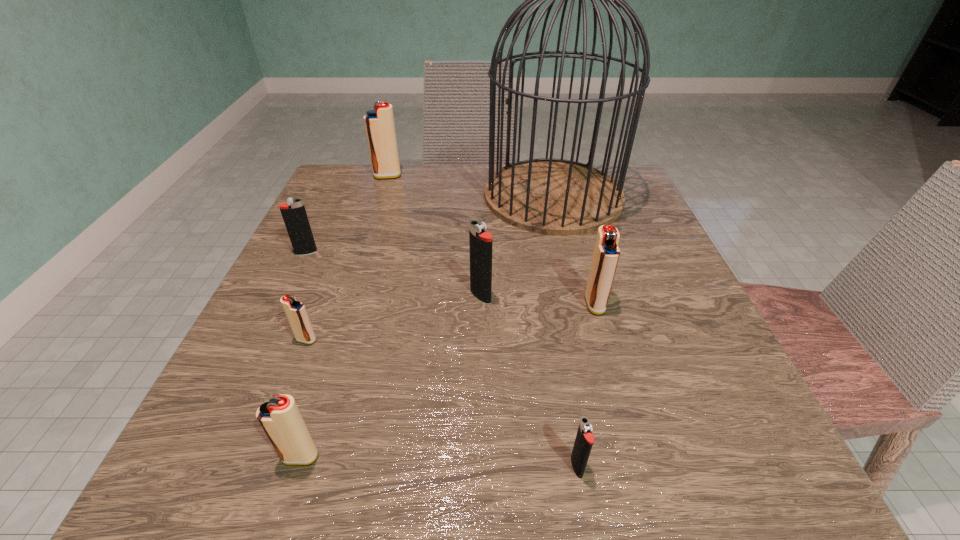
Identify the location of the nearest red igniter. (280, 418).

Locate an element on the screen. Image resolution: width=960 pixels, height=540 pixels. the third farthest red igniter is located at coordinates (295, 311).

Locate an element on the screen. This screenshot has width=960, height=540. the fifth farthest igniter is located at coordinates (295, 311).

The image size is (960, 540). I want to click on the sixth igniter from left to right, so click(584, 440).

This screenshot has width=960, height=540. In order to click on the nearest black igniter in this screenshot , I will do `click(584, 440)`.

At what (x,y) coordinates should I click in order to perform the action: click on free space located at the door of the tallest object. Please return your answer as a coordinate pair (x, y). Looking at the image, I should click on (341, 196).

Identify the location of free spot located at the door of the tallest object. This screenshot has width=960, height=540. (371, 196).

Where is `vacant region located at the door of the tallest object`? vacant region located at the door of the tallest object is located at coordinates (353, 196).

Locate an element on the screen. The height and width of the screenshot is (540, 960). vacant space located 0.100m on the right of the biggest red igniter is located at coordinates (442, 176).

Locate an element on the screen. blank area located on the back of the second biggest red igniter is located at coordinates (567, 205).